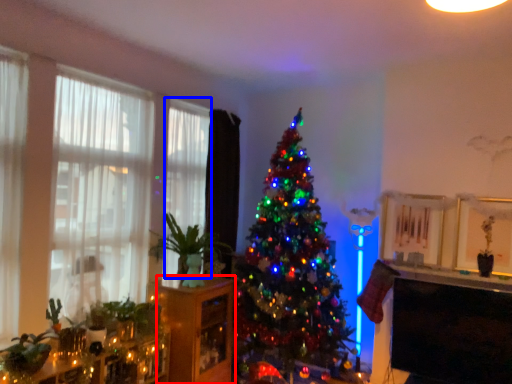
Question: Which point is closer to the camera, shelf (highlighted by a red box) or curtain (highlighted by a blue box)?

Choices:
 (A) shelf
 (B) curtain

Answer: (A)